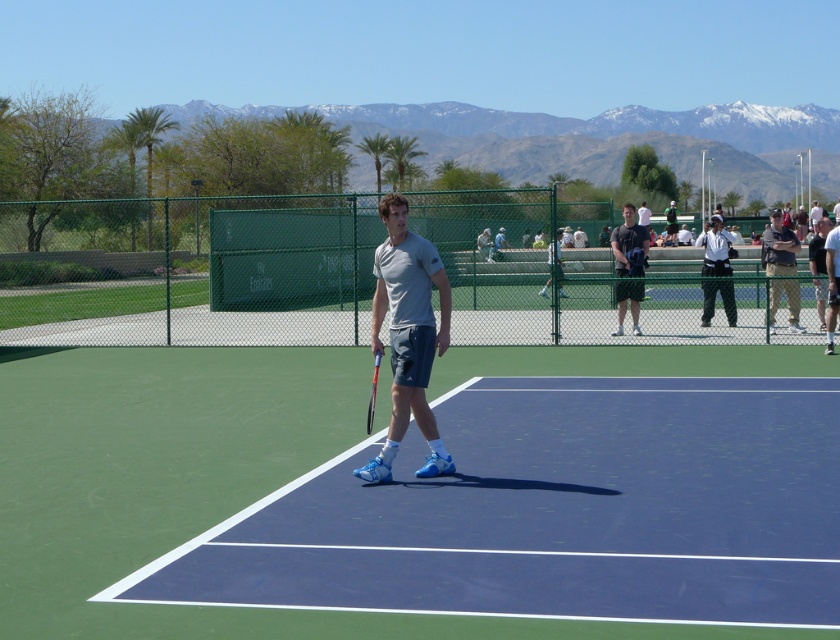
Question: Which object is farther from the camera taking this photo?

Choices:
 (A) khaki pants at center
 (B) gray matte tennis racket at center
 (C) black matte tennis racket at center

Answer: (A)

Question: Does khaki pants at center have a larger size compared to black matte tennis racket at center?

Choices:
 (A) yes
 (B) no

Answer: (A)

Question: Which point appears farthest from the camera in this image?

Choices:
 (A) (445, 300)
 (B) (672, 212)
 (C) (623, 272)
 (D) (735, 324)

Answer: (B)

Question: Does gray matte tennis racket at center come in front of dark green pants at right?

Choices:
 (A) no
 (B) yes

Answer: (B)

Question: Among these objects, which one is nearest to the camera?

Choices:
 (A) matte gray shirt at center
 (B) dark green pants at right

Answer: (B)

Question: Can you confirm if gray matte tennis racket at center is smaller than matte gray shirt at center?

Choices:
 (A) no
 (B) yes

Answer: (B)